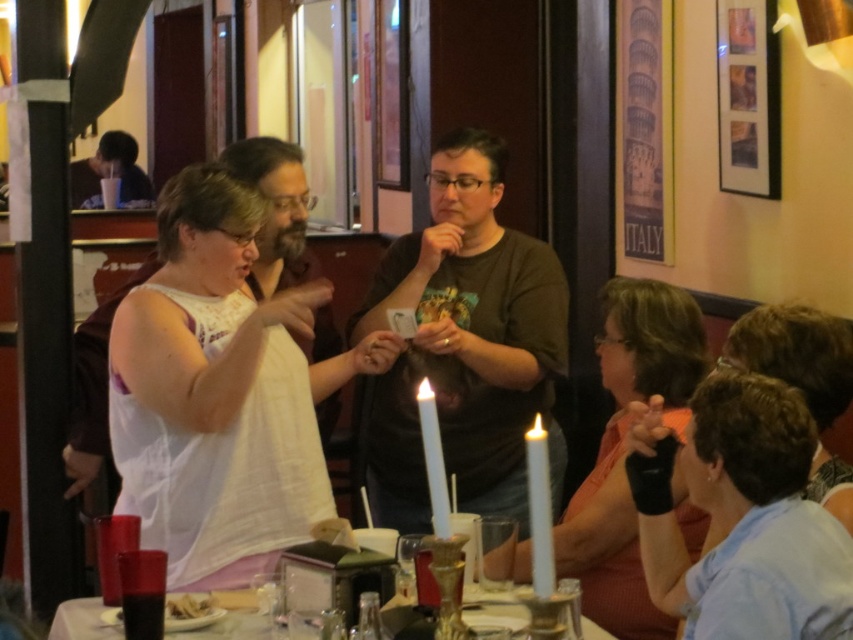
You are a waiter in a restaurant and need to place a new order of drinks on the table. The white fabric shirt at center is currently blocking the way to the translucent glass table at center. Which object should you move first to access the table?

The white fabric shirt at center is in front of the translucent glass table at center, so you should move the white fabric shirt at center first to access the table.

You are a waiter in the restaurant and need to place a new menu on the table. The menu is 10 cm tall. The table has limited space between the white wax candle at center and the dark brown bread at lower left. Can you fit the menu vertically between them?

The white wax candle at center is located above the dark brown bread at lower left, so the vertical space between them is the distance from the candle to the bread. Since the menu is 10 cm tall and the vertical space is not specified, but the candle is above the bread, there might be enough vertical space to place the menu between them. However, without exact measurements, it is uncertain. The answer cannot be definitively determined with the given information.

You are standing at the center of the room and see two points marked in the scene. Which point is closer to you, point (817, 554) or point (637, 589)?

Point (817, 554) is in front of point (637, 589), so it is closer to you.